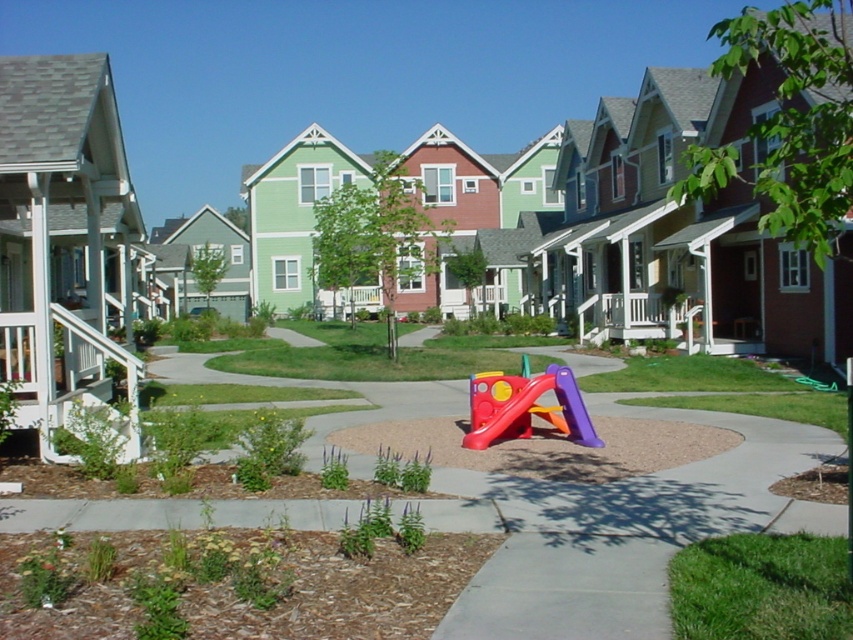
You are a parent trying to decide whether to let your child play on the rubberized plastic slide at center. The slide is wider than the white painted wood porch at lower left. Considering the width, which object is wider?

The rubberized plastic slide at center is wider than the white painted wood porch at lower left.

You are a parent trying to decide whether to let your child play on the rubberized plastic slide at center and the white painted wood porch at lower left. Considering the height difference, which one is safer for a young child to climb?

The rubberized plastic slide at center has a lesser height compared to the white painted wood porch at lower left, so it is safer for a young child to climb the rubberized plastic slide at center.

You are a parent pushing a stroller that is 3 feet wide. You want to take the stroller from the rubberized plastic slide at center to the white painted wood porch at lower left. Is the path between them wide enough for your stroller?

The distance between the rubberized plastic slide at center and the white painted wood porch at lower left is 12.59 feet. Since the stroller is only 3 feet wide, the path is wide enough for the stroller to pass through.